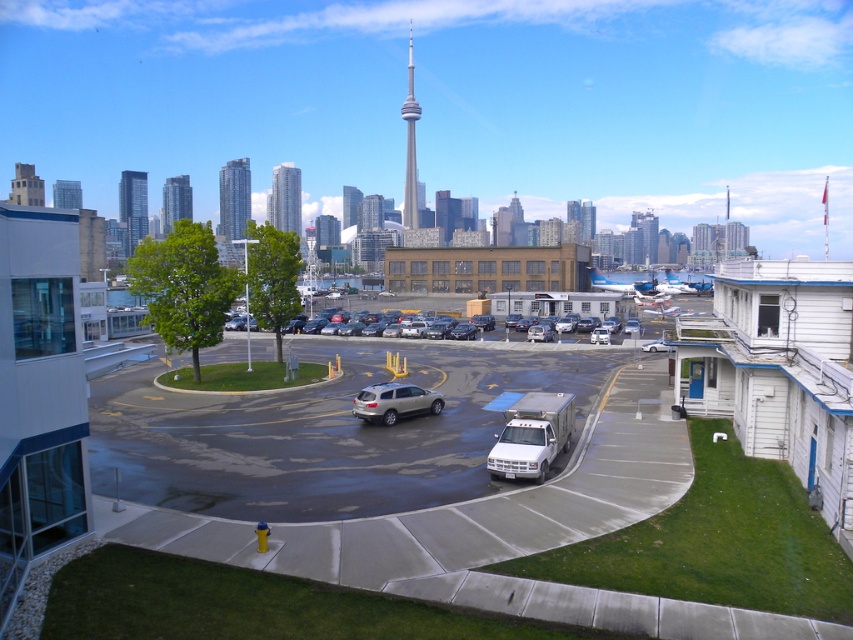
How distant is glassy reflective skyscraper at left from gray concrete building at upper left?

glassy reflective skyscraper at left is 68.77 feet from gray concrete building at upper left.

Does glassy reflective skyscraper at left have a smaller size compared to gray concrete building at upper left?

Yes.

Is point (120, 192) more distant than point (80, 198)?

No, (120, 192) is closer to viewer.

What are the coordinates of `glassy reflective skyscraper at left` in the screenshot? It's located at (132, 205).

Does silver glass skyscraper at upper left have a greater width compared to glassy reflective skyscraper at left?

No, silver glass skyscraper at upper left is not wider than glassy reflective skyscraper at left.

Between point (236, 196) and point (131, 240), which one is positioned behind?

Point (236, 196)

Measure the distance between silver glass skyscraper at upper left and camera.

285.86 meters

You are a GUI agent. You are given a task and a screenshot of the screen. Output one action in this format:
    pyautogui.click(x=<x>, y=<y>)
    Task: Click on the silver glass skyscraper at upper left
    
    Given the screenshot: What is the action you would take?
    pyautogui.click(x=234, y=198)

Which is in front, point (165, 205) or point (22, 170)?

Point (22, 170) is more forward.

Does glassy reflective skyscraper at upper left have a lesser width compared to matte gray tower at upper left?

Correct, glassy reflective skyscraper at upper left's width is less than matte gray tower at upper left's.

Is point (184, 198) less distant than point (9, 202)?

No, (184, 198) is behind (9, 202).

The image size is (853, 640). What are the coordinates of `glassy reflective skyscraper at upper left` in the screenshot? It's located at (175, 202).